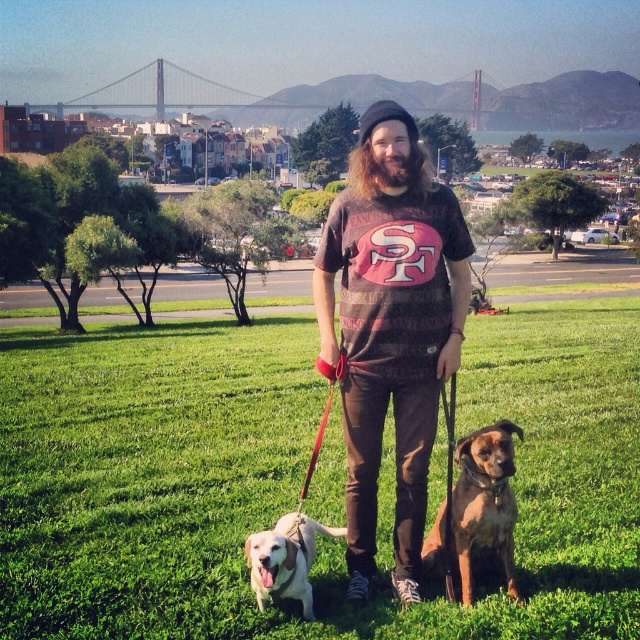
Which is below, green grass at center or brown cotton t-shirt at center?

green grass at center

How much distance is there between green grass at center and brown cotton t-shirt at center?

A distance of 4.42 meters exists between green grass at center and brown cotton t-shirt at center.

I want to click on green grass at center, so click(298, 477).

Find the location of a particular element. metallic bridge at upper center is located at coordinates (310, 96).

Does metallic bridge at upper center have a smaller size compared to white fur dog at lower left?

No.

Where is `metallic bridge at upper center`? metallic bridge at upper center is located at coordinates coord(310,96).

Where is `metallic bridge at upper center`? The width and height of the screenshot is (640, 640). metallic bridge at upper center is located at coordinates (310, 96).

Is point (481, 525) more distant than point (284, 572)?

Yes, point (481, 525) is behind point (284, 572).

Measure the distance between brown leather dog at lower right and white fur dog at lower left.

36.31 inches

Between point (422, 552) and point (288, 572), which one is positioned in front?

Positioned in front is point (288, 572).

At what (x,y) coordinates should I click in order to perform the action: click on brown leather dog at lower right. Please return your answer as a coordinate pair (x, y). The image size is (640, 640). Looking at the image, I should click on (477, 508).